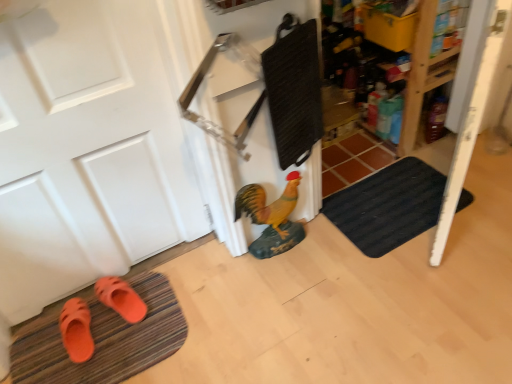
Locate an element on the screen. This screenshot has height=384, width=512. vacant area that lies to the right of orange rubber bath mat at lower left, which appears as the 2th bath mat when viewed from the right is located at coordinates (221, 315).